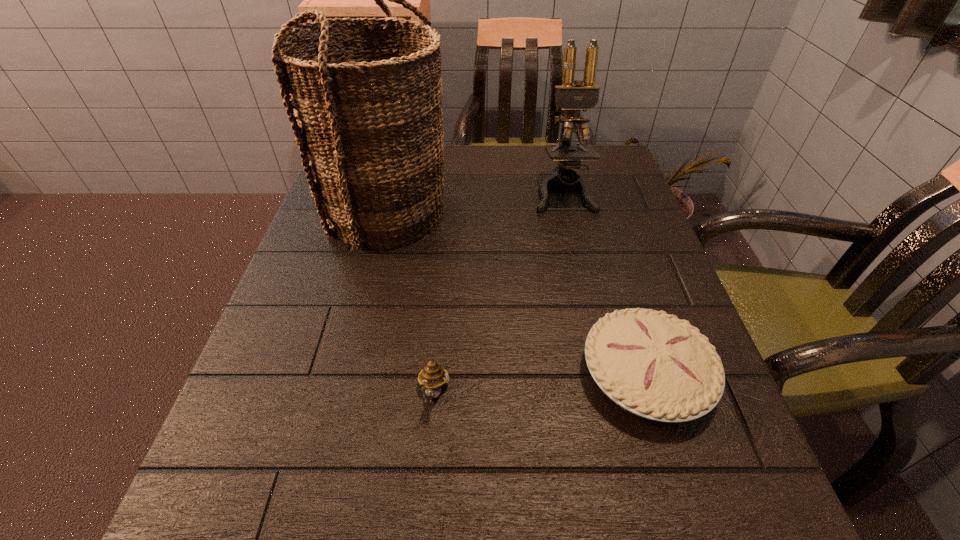
Where is `basket`? The height and width of the screenshot is (540, 960). basket is located at coordinates (368, 119).

Find the location of a particular element. The height and width of the screenshot is (540, 960). the second tallest object is located at coordinates (572, 98).

What are the coordinates of `the second shortest object` in the screenshot? It's located at (432, 377).

Locate an element on the screen. This screenshot has height=540, width=960. pie is located at coordinates (650, 363).

I want to click on vacant space located 0.060m on the right of the basket, so click(476, 212).

Find the location of a particular element. vacant area situated at the eyepieces of the third shortest object is located at coordinates (585, 285).

Locate an element on the screen. The height and width of the screenshot is (540, 960). blank space located 0.060m on the face of the snail is located at coordinates (428, 459).

You are a GUI agent. You are given a task and a screenshot of the screen. Output one action in this format:
    pyautogui.click(x=<x>, y=<y>)
    Task: Click on the vacant space situated on the back of the shortest object
    This screenshot has height=540, width=960.
    Given the screenshot: What is the action you would take?
    pyautogui.click(x=617, y=282)

Where is `basket that is at the far edge`? The width and height of the screenshot is (960, 540). basket that is at the far edge is located at coordinates (368, 119).

I want to click on microscope situated at the far edge, so click(x=572, y=98).